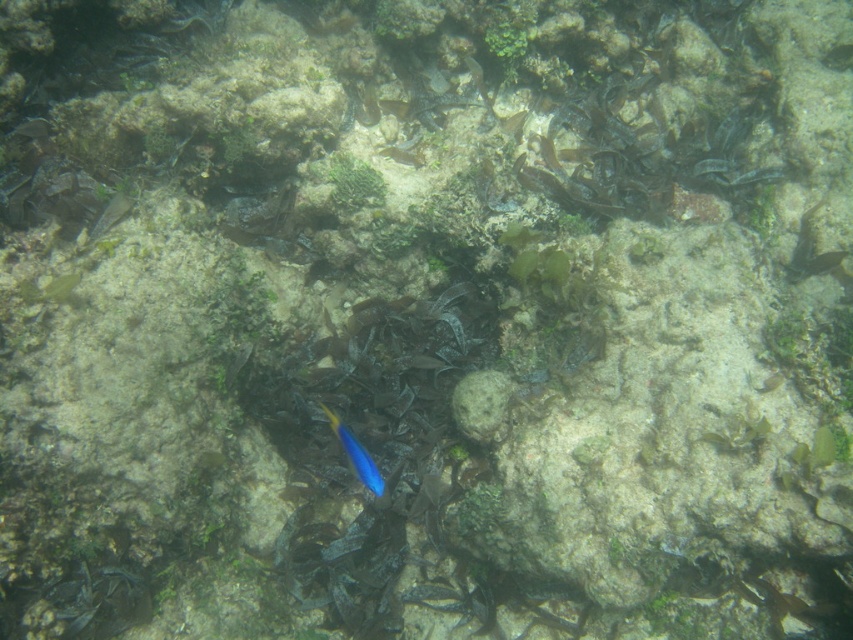
Which is in front, point (503, 374) or point (347, 440)?

Positioned in front is point (503, 374).

This screenshot has height=640, width=853. In order to click on white matte rock at center in this screenshot , I will do [x=480, y=404].

Where is `white matte rock at center`? Image resolution: width=853 pixels, height=640 pixels. white matte rock at center is located at coordinates (480, 404).